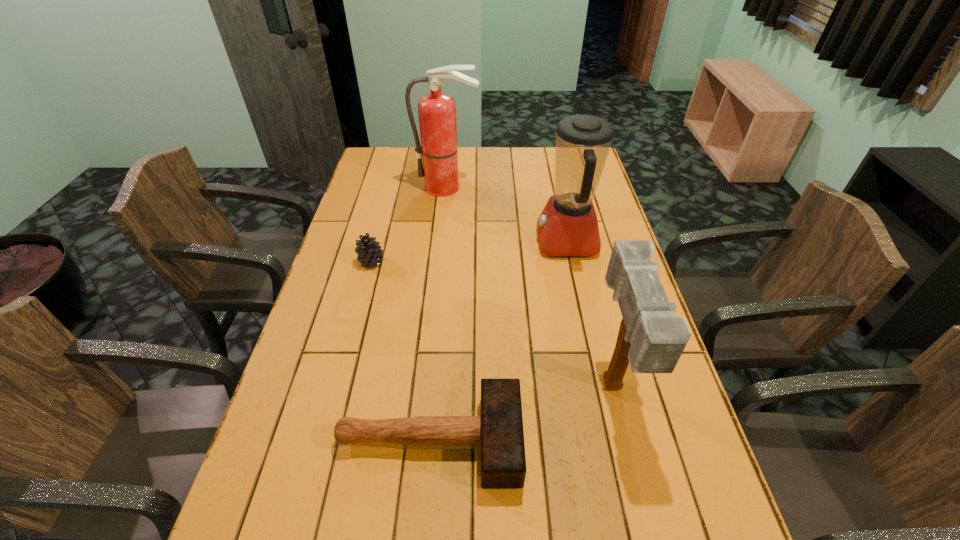
In order to click on free point located 0.160m on the front of the blender near the controls in this screenshot , I will do `click(488, 241)`.

This screenshot has width=960, height=540. I want to click on vacant space situated 0.240m on the left of the taller mallet, so (496, 387).

Where is `free space located on the back of the fourth tallest object`? Image resolution: width=960 pixels, height=540 pixels. free space located on the back of the fourth tallest object is located at coordinates (391, 188).

Locate an element on the screen. The width and height of the screenshot is (960, 540). vacant space located 0.380m on the hammer head face of the shortest object is located at coordinates (695, 440).

Image resolution: width=960 pixels, height=540 pixels. In order to click on pinecone present at the left edge in this screenshot , I will do `click(369, 252)`.

The width and height of the screenshot is (960, 540). Identify the location of mallet that is at the left edge. (499, 431).

You are a GUI agent. You are given a task and a screenshot of the screen. Output one action in this format:
    pyautogui.click(x=<x>, y=<y>)
    Task: Click on the blender present at the right edge
    The image size is (960, 540).
    Given the screenshot: What is the action you would take?
    pyautogui.click(x=568, y=226)

Identify the location of mallet at the right edge. (651, 338).

Find the location of a particular element. The image size is (960, 540). vacant space at the far edge of the desktop is located at coordinates (459, 148).

Locate an element on the screen. This screenshot has height=540, width=960. vacant space at the left edge of the desktop is located at coordinates (345, 301).